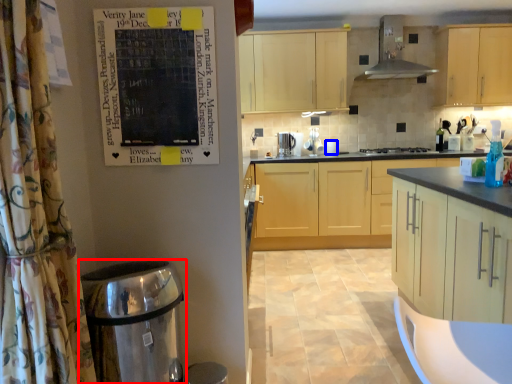
Question: Which point is further to the camera, water heater (highlighted by a red box) or appliance (highlighted by a blue box)?

Choices:
 (A) water heater
 (B) appliance

Answer: (B)